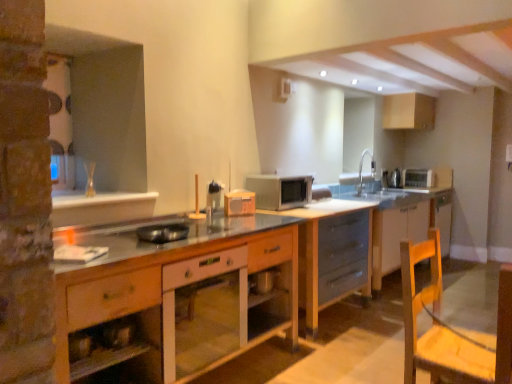
Question: Can you confirm if wooden cabinet at center, acting as the 4th cabinetry starting from the back, is smaller than silver metallic toaster at upper right, which appears as the 4th appliance when viewed from the left?

Choices:
 (A) yes
 (B) no

Answer: (B)

Question: Does wooden cabinet at center, acting as the 4th cabinetry starting from the back, have a greater width compared to silver metallic toaster at upper right, positioned as the first appliance in back-to-front order?

Choices:
 (A) no
 (B) yes

Answer: (B)

Question: Is the position of wooden cabinet at center, acting as the 4th cabinetry starting from the back, more distant than that of silver metallic toaster at upper right, positioned as the first appliance in back-to-front order?

Choices:
 (A) no
 (B) yes

Answer: (A)

Question: Could you tell me if wooden cabinet at center, acting as the 4th cabinetry starting from the back, is turned towards silver metallic toaster at upper right, positioned as the first appliance in back-to-front order?

Choices:
 (A) yes
 (B) no

Answer: (B)

Question: Is wooden cabinet at center, which ranks as the fourth cabinetry in right-to-left order, completely or partially outside of silver metallic toaster at upper right, the first appliance when ordered from right to left?

Choices:
 (A) yes
 (B) no

Answer: (A)

Question: From a real-world perspective, is matte white cabinet at upper right, placed as the 1th cabinetry when sorted from right to left, physically located above or below metallic silver toaster at upper right, the third appliance in the left-to-right sequence?

Choices:
 (A) above
 (B) below

Answer: (A)

Question: From the image's perspective, is matte white cabinet at upper right, the first cabinetry when ordered from back to front, positioned above or below metallic silver toaster at upper right, placed as the second appliance when sorted from right to left?

Choices:
 (A) above
 (B) below

Answer: (A)

Question: Which is correct: matte white cabinet at upper right, which ranks as the 4th cabinetry in left-to-right order, is inside metallic silver toaster at upper right, placed as the second appliance when sorted from right to left, or outside of it?

Choices:
 (A) inside
 (B) outside

Answer: (B)

Question: Considering the positions of matte white cabinet at upper right, the fourth cabinetry viewed from the front, and metallic silver toaster at upper right, positioned as the 2th appliance in back-to-front order, in the image, is matte white cabinet at upper right, the fourth cabinetry viewed from the front, bigger or smaller than metallic silver toaster at upper right, positioned as the 2th appliance in back-to-front order,?

Choices:
 (A) big
 (B) small

Answer: (A)

Question: Considering their positions, is wooden swivel chair at lower right located in front of or behind white glossy cabinet at center, acting as the 2th cabinetry starting from the front?

Choices:
 (A) behind
 (B) front

Answer: (B)

Question: From the image's perspective, is wooden swivel chair at lower right above or below white glossy cabinet at center, the third cabinetry from the back?

Choices:
 (A) below
 (B) above

Answer: (A)

Question: Is wooden swivel chair at lower right taller or shorter than white glossy cabinet at center, acting as the 3th cabinetry starting from the right?

Choices:
 (A) tall
 (B) short

Answer: (A)

Question: Based on their positions, is wooden swivel chair at lower right located to the left or right of white glossy cabinet at center, acting as the 2th cabinetry starting from the front?

Choices:
 (A) left
 (B) right

Answer: (B)

Question: Choose the correct answer: Is wooden swivel chair at lower right inside silver metallic toaster at upper right, which appears as the 4th appliance when viewed from the left, or outside it?

Choices:
 (A) outside
 (B) inside

Answer: (A)

Question: From a real-world perspective, is wooden swivel chair at lower right physically located above or below silver metallic toaster at upper right, which appears as the 4th appliance when viewed from the left?

Choices:
 (A) above
 (B) below

Answer: (B)